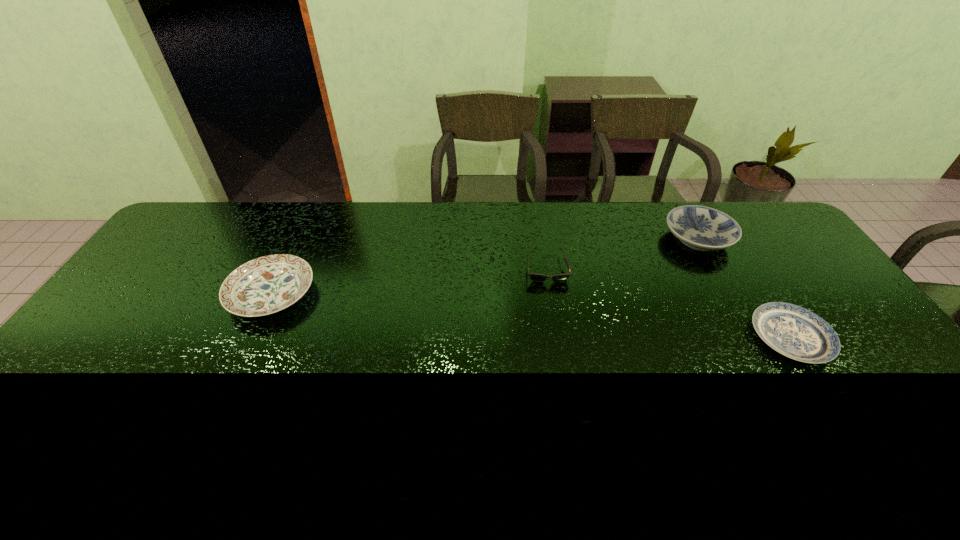
In order to click on object that is at the far edge in this screenshot , I will do `click(701, 228)`.

I want to click on object that is at the right edge, so click(795, 332).

In the image, there is a desktop. Where is `vacant space at the far edge`? The image size is (960, 540). vacant space at the far edge is located at coordinates (242, 238).

Where is `vacant space at the near edge of the desktop`? This screenshot has height=540, width=960. vacant space at the near edge of the desktop is located at coordinates (114, 467).

The width and height of the screenshot is (960, 540). I want to click on free space at the right edge, so click(791, 272).

In the image, there is a desktop. What are the coordinates of `vacant region at the far right corner` in the screenshot? It's located at (764, 241).

This screenshot has width=960, height=540. I want to click on vacant area that lies between the farthest plate and the third object from right to left, so click(622, 253).

In order to click on vacant area that lies between the farthest plate and the sunglasses in this screenshot , I will do `click(622, 253)`.

Locate an element on the screen. The image size is (960, 540). vacant space that's between the leftmost plate and the second object from left to right is located at coordinates (409, 281).

Find the location of a particular element. vacant space that's between the tallest object and the shortest plate is located at coordinates (744, 288).